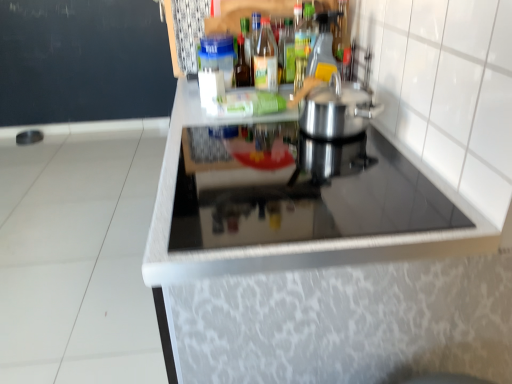
This screenshot has width=512, height=384. Identify the location of free region on the left part of satin silver pot at center. (252, 144).